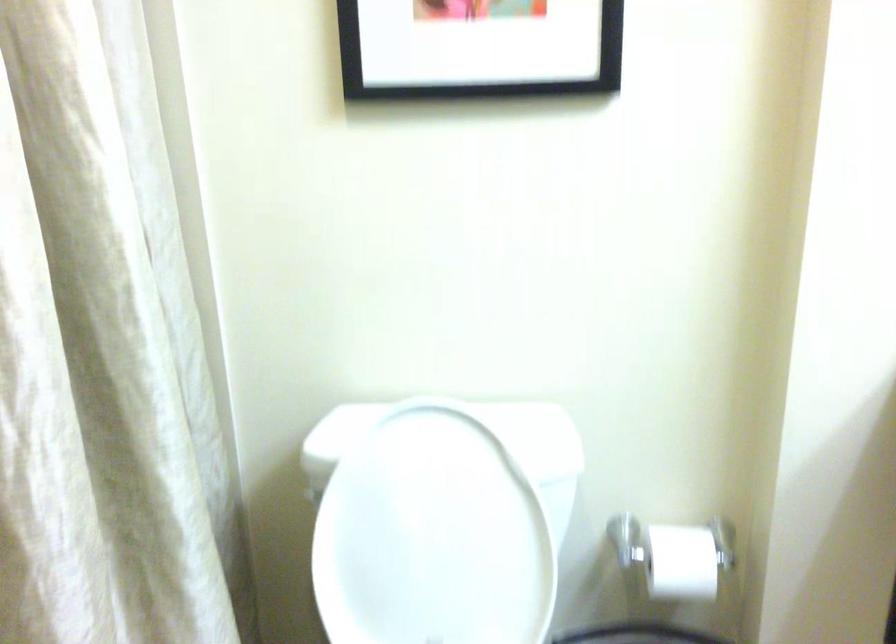
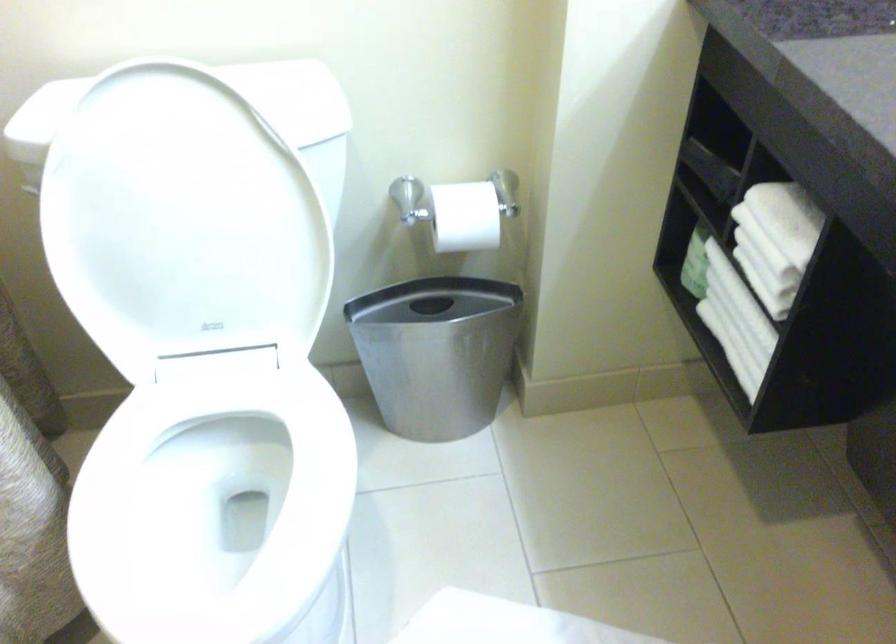
Question: The images are taken continuously from a first-person perspective. In which direction is your viewpoint rotating?

Choices:
 (A) Left
 (B) Right
 (C) Up
 (D) Down

Answer: (D)